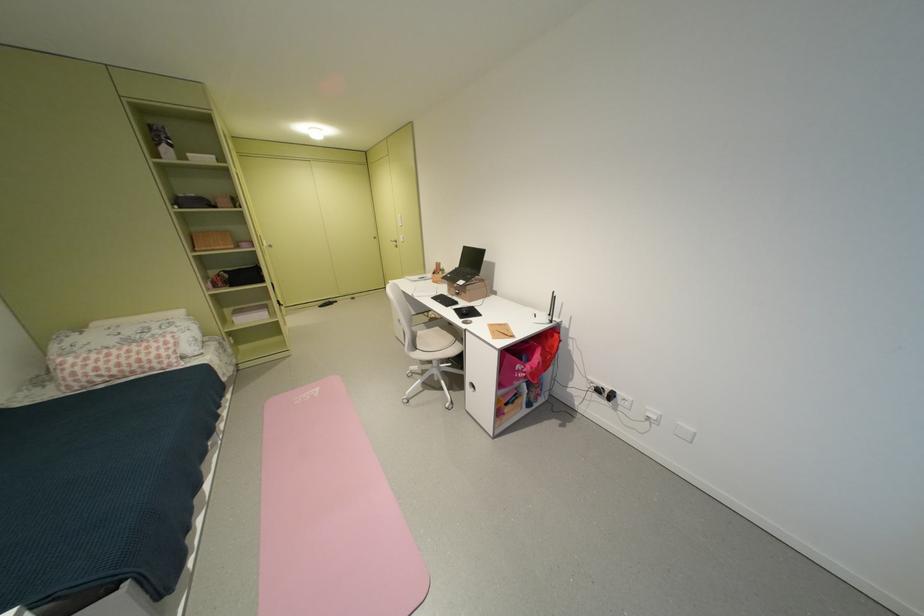
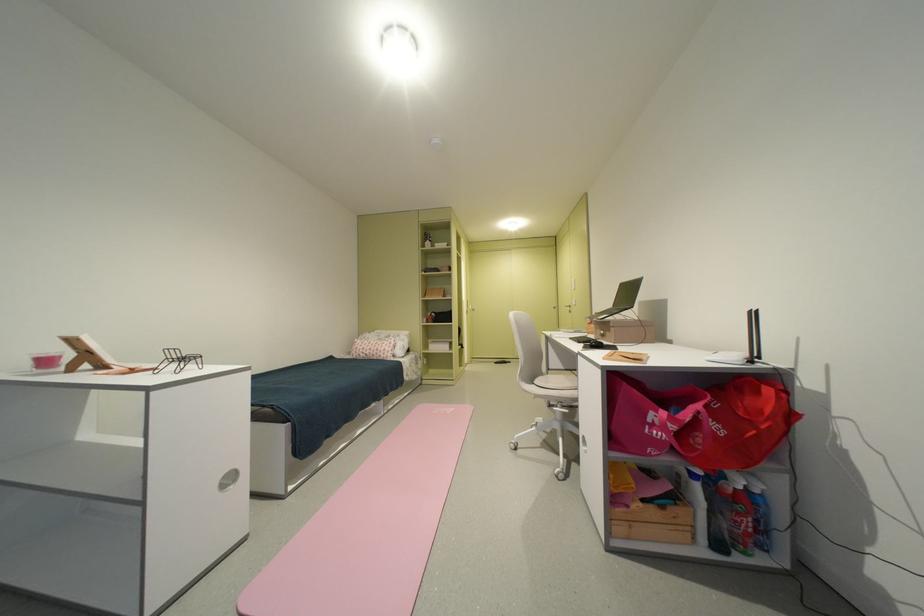
In the second image, find the point that corresponds to [530,376] in the first image.

(665, 432)